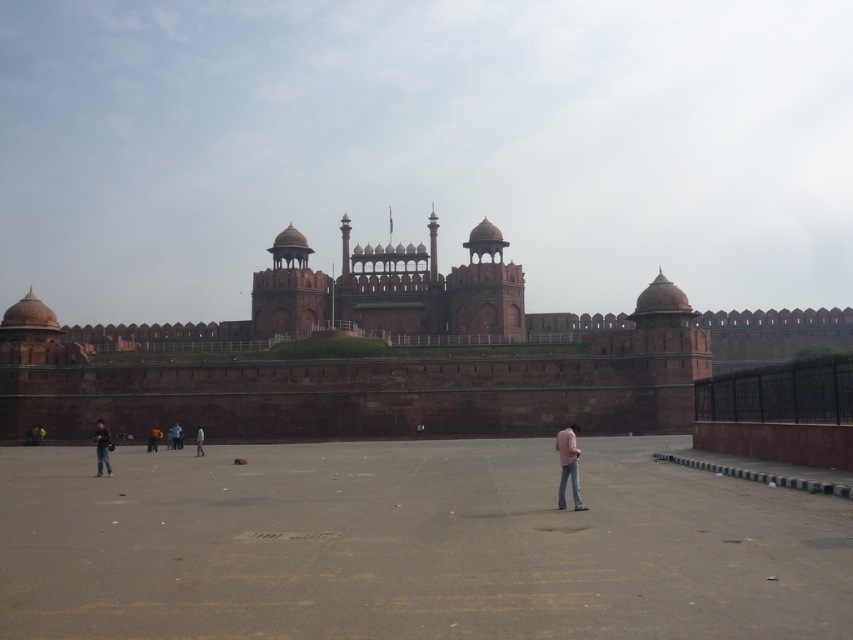
Based on the photo, who is positioned more to the left, pink fabric at center or light blue jeans at center?

Positioned to the left is light blue jeans at center.

Is point (575, 429) closer to camera compared to point (173, 438)?

Yes, point (575, 429) is closer to viewer.

Identify the location of pink fabric at center. The width and height of the screenshot is (853, 640). (567, 465).

Where is `pink fabric at center`? pink fabric at center is located at coordinates (567, 465).

Between dark blue jeans at left and light blue jeans at center, which one is positioned lower?

light blue jeans at center

Does dark blue jeans at left appear on the left side of light blue jeans at center?

Indeed, dark blue jeans at left is positioned on the left side of light blue jeans at center.

The image size is (853, 640). Describe the element at coordinates (102, 448) in the screenshot. I see `dark blue jeans at left` at that location.

Where is `dark blue jeans at left`? dark blue jeans at left is located at coordinates (102, 448).

Who is positioned more to the right, pink fabric at center or dark blue jeans at left?

From the viewer's perspective, pink fabric at center appears more on the right side.

Between pink fabric at center and dark blue jeans at left, which one has less height?

dark blue jeans at left

Between point (572, 442) and point (99, 428), which one is positioned behind?

Point (99, 428)

What are the coordinates of `pink fabric at center` in the screenshot? It's located at (567, 465).